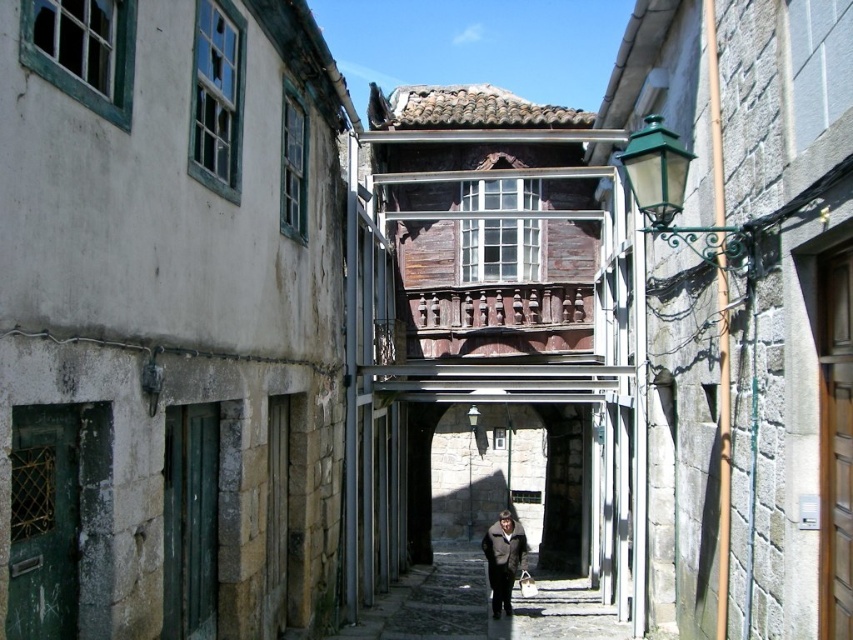
You are a delivery person carrying a large box and need to walk through the alley. The smooth stone path at center and the dark brown leather coat at center are both in your path. Which object should you avoid stepping on to ensure safe passage?

You should avoid stepping on the dark brown leather coat at center because the smooth stone path at center is closer to the viewer and safer for walking on, while the dark brown leather coat at center is farther away and might be an obstacle.

Consider the image. You are a delivery person carrying a package that requires a clear path of at least 3 meters to maneuver safely. You see the smooth stone path at center and the dark brown leather coat at center in the alleyway. Is there enough space between them to move the package safely?

The smooth stone path at center is 3.53 meters from the dark brown leather coat at center, which is more than the required 3 meters. Therefore, there is sufficient space to maneuver the package safely between them.